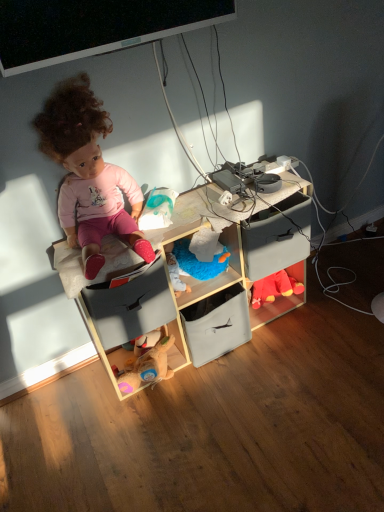
Find the location of a particular element. This screenshot has height=512, width=384. free space in front of velvet red plush toy at lower right, the second toy viewed from the front is located at coordinates (286, 329).